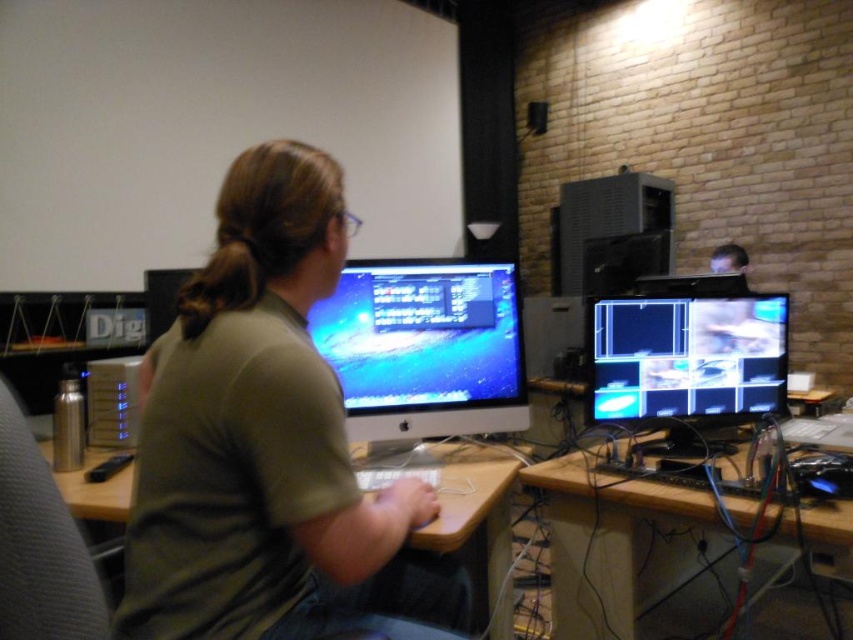
Is black glossy monitor at right smaller than brown hair at upper center?

Actually, black glossy monitor at right might be larger than brown hair at upper center.

Who is more forward, (x=627, y=326) or (x=260, y=266)?

Point (x=260, y=266) is more forward.

Does point (627, 333) come behind point (254, 292)?

That is True.

The width and height of the screenshot is (853, 640). Identify the location of black glossy monitor at right. (686, 364).

Who is lower down, black glossy monitor at right or wooden desk at center?

Positioned lower is wooden desk at center.

The width and height of the screenshot is (853, 640). What do you see at coordinates (686, 364) in the screenshot?
I see `black glossy monitor at right` at bounding box center [686, 364].

Where is `black glossy monitor at right`? This screenshot has height=640, width=853. black glossy monitor at right is located at coordinates (686, 364).

The height and width of the screenshot is (640, 853). Find the location of `satin black monitor at center`. satin black monitor at center is located at coordinates (425, 348).

Is point (357, 426) positioned before point (590, 422)?

Yes.

Is point (335, 333) more distant than point (746, 340)?

No, it is not.

This screenshot has width=853, height=640. I want to click on satin black monitor at center, so click(425, 348).